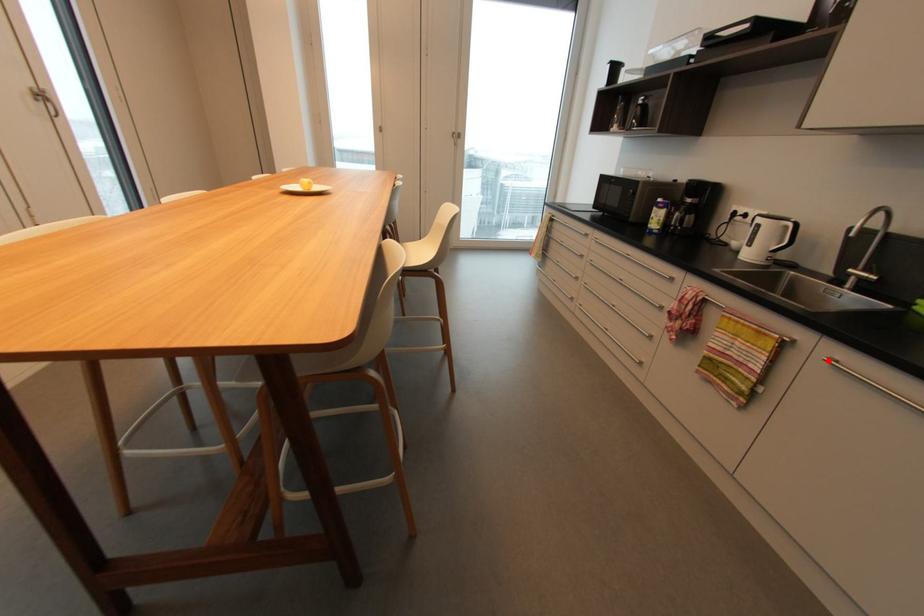
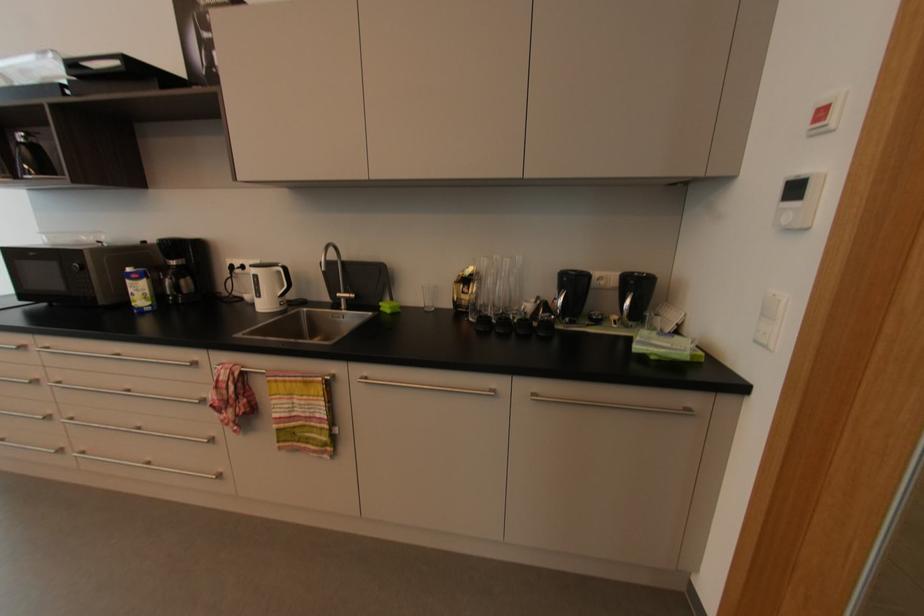
Find the pixel in the second image that matches the highlighted location in the first image.

(362, 382)